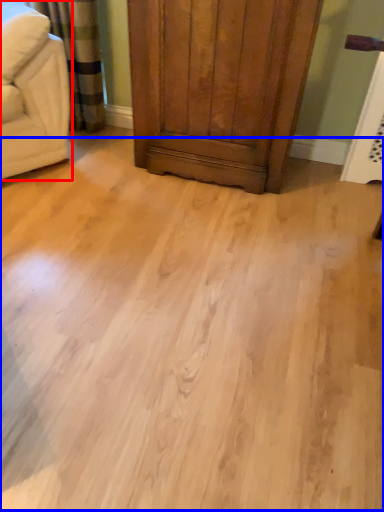
Question: Which point is further to the camera, furniture (highlighted by a red box) or plain (highlighted by a blue box)?

Choices:
 (A) furniture
 (B) plain

Answer: (A)